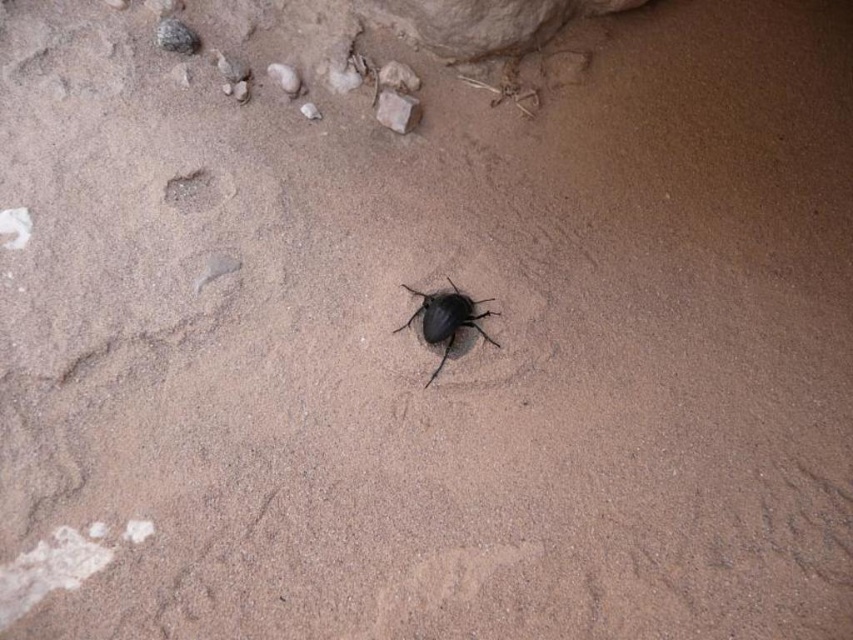
Who is more distant from viewer, (473,321) or (404,125)?

Positioned behind is point (404,125).

Looking at this image, can you confirm if black matte beetle at center is positioned below smooth brown rock at upper center?

Indeed, black matte beetle at center is positioned under smooth brown rock at upper center.

Between point (451, 337) and point (376, 104), which one is positioned in front?

Point (451, 337) is more forward.

Find the location of a particular element. black matte beetle at center is located at coordinates (445, 320).